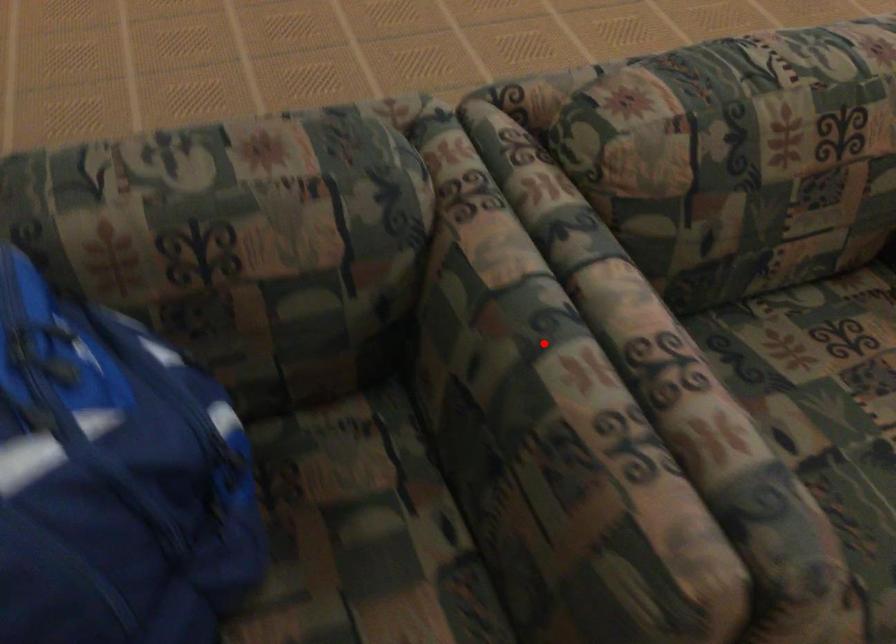
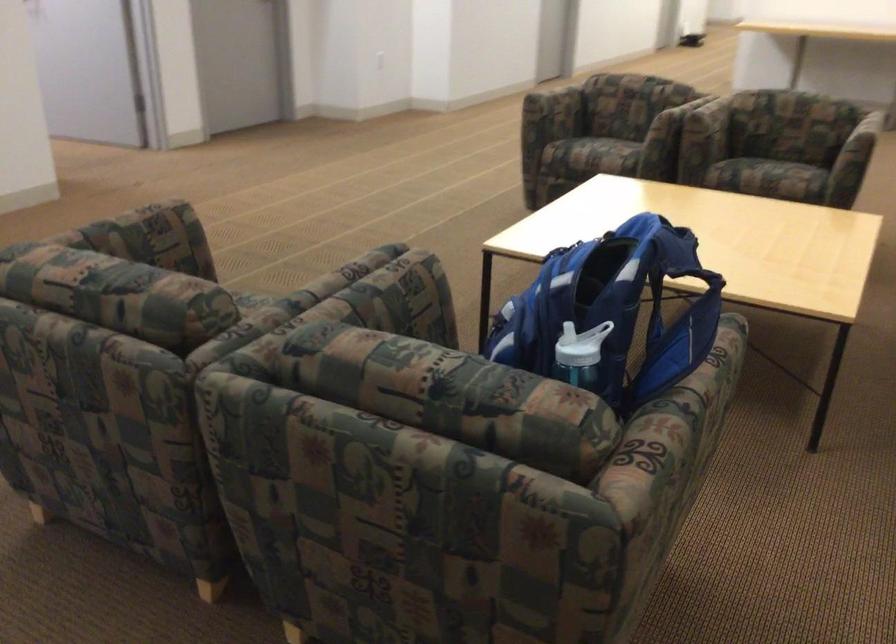
Where in the second image is the point corresponding to the highlighted location from the first image?

(362, 292)